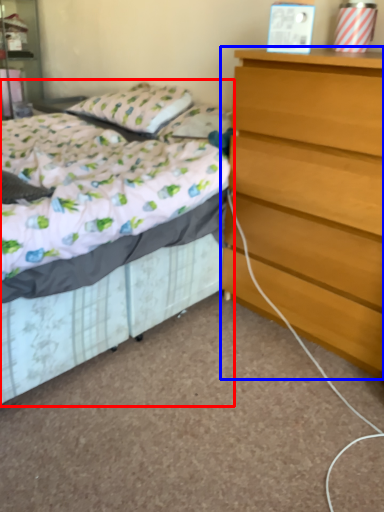
Question: Which point is further to the camera, bed (highlighted by a red box) or chest of drawers (highlighted by a blue box)?

Choices:
 (A) bed
 (B) chest of drawers

Answer: (B)